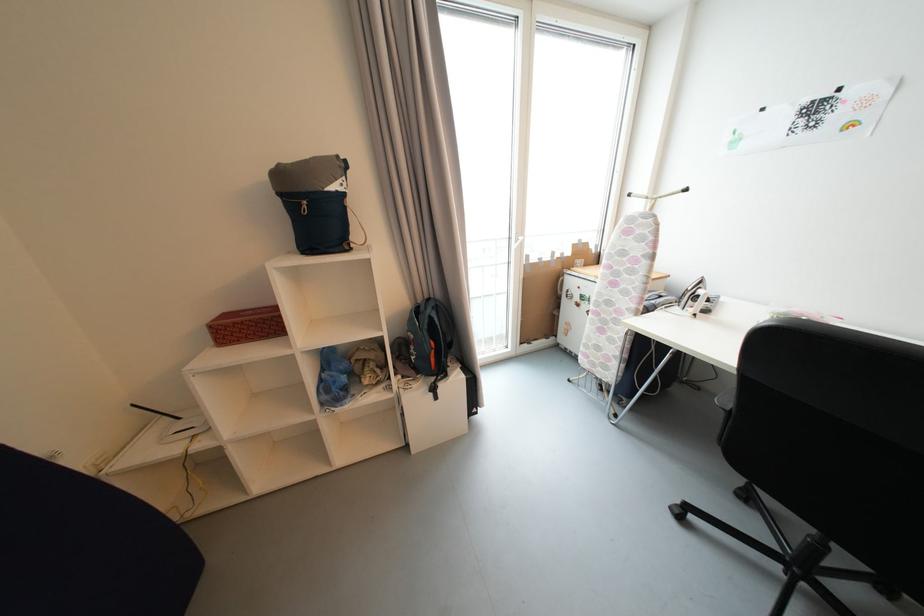
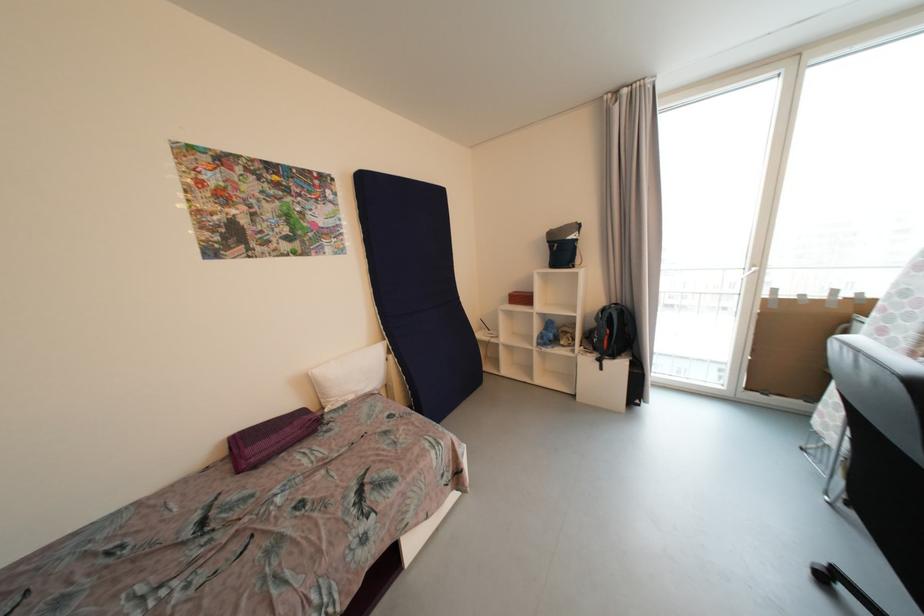
Where in the second image is the point corresponding to point (526, 345) from the first image?

(752, 390)